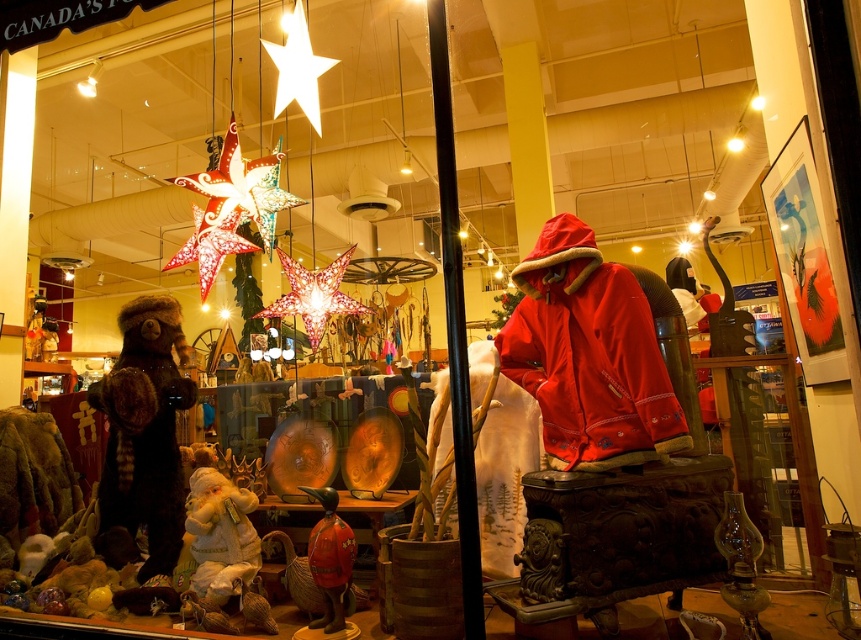
Question: Estimate the real-world distances between objects in this image. Which object is farther from the fuzzy brown bear at left?

Choices:
 (A) red fleece jacket at center
 (B) shiny red duck at center
 (C) white plush santa at center

Answer: (A)

Question: Which point appears farthest from the camera in this image?

Choices:
 (A) (521, 348)
 (B) (195, 577)
 (C) (344, 540)
 (D) (170, 499)

Answer: (D)

Question: Can you confirm if red fleece jacket at center is smaller than shiny red duck at center?

Choices:
 (A) no
 (B) yes

Answer: (A)

Question: Is red fleece jacket at center thinner than shiny red duck at center?

Choices:
 (A) yes
 (B) no

Answer: (B)

Question: Which object appears farthest from the camera in this image?

Choices:
 (A) white plush santa at center
 (B) shiny red duck at center
 (C) red fleece jacket at center

Answer: (A)

Question: Considering the relative positions of fuzzy brown bear at left and shiny red duck at center in the image provided, where is fuzzy brown bear at left located with respect to shiny red duck at center?

Choices:
 (A) right
 (B) left

Answer: (B)